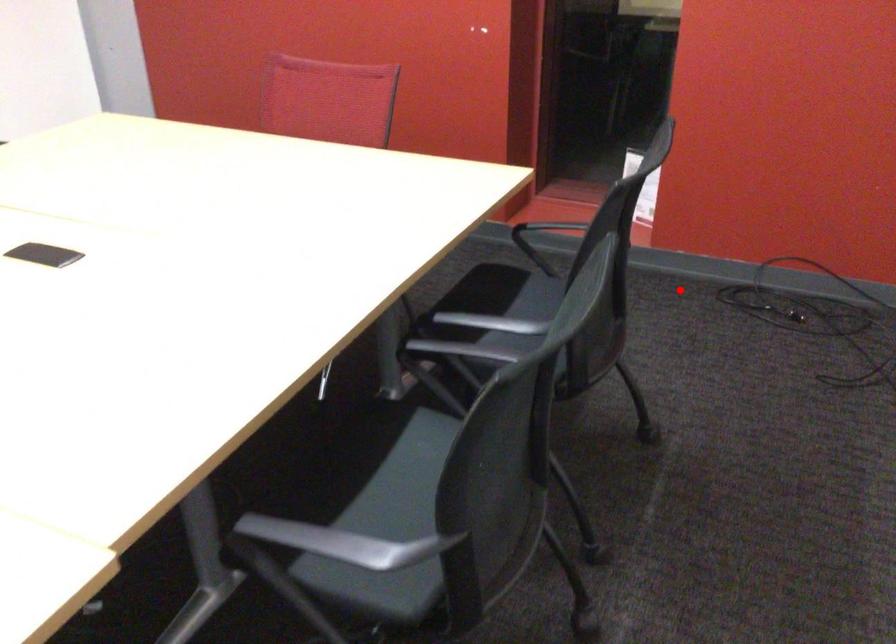
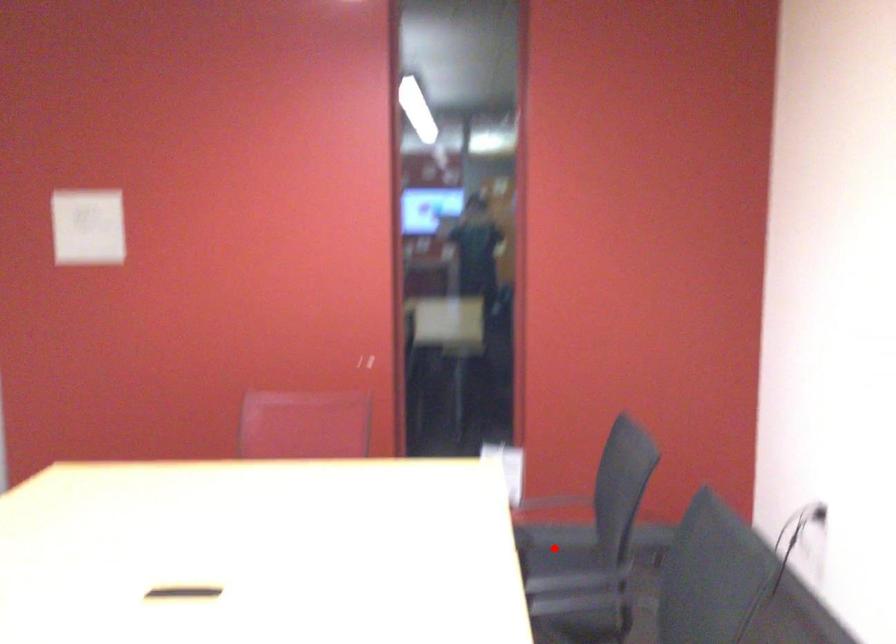
I am providing you with two images of the same scene from different viewpoints. A red point is marked on the first image and another point is marked on the second image. Do the highlighted points in image1 and image2 indicate the same real-world spot?

Yes